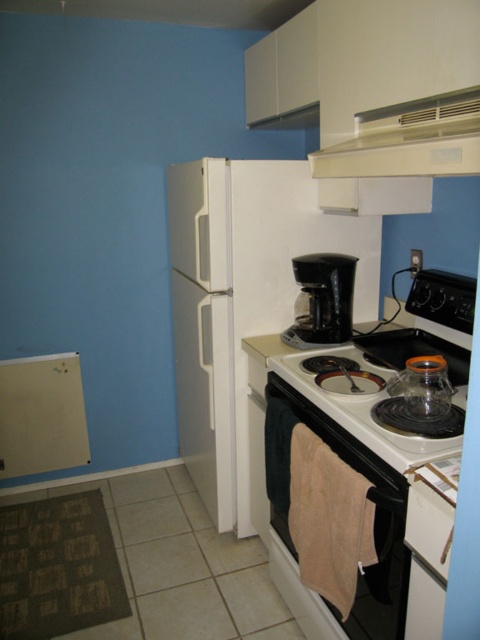
Can you confirm if black glossy oven at center is shorter than black plastic coffee maker at center?

No.

Is black glossy oven at center taller than black plastic coffee maker at center?

Indeed, black glossy oven at center has a greater height compared to black plastic coffee maker at center.

This screenshot has width=480, height=640. Identify the location of black glossy oven at center. (383, 586).

Locate an element on the screen. black glossy oven at center is located at coordinates (383, 586).

From the picture: Is white matte refrigerator at left further to camera compared to black glossy oven at center?

Yes, it is behind black glossy oven at center.

Does point (201, 483) come closer to viewer compared to point (350, 612)?

No, it is behind (350, 612).

What do you see at coordinates (241, 301) in the screenshot? The image size is (480, 640). I see `white matte refrigerator at left` at bounding box center [241, 301].

The image size is (480, 640). I want to click on white matte refrigerator at left, so click(241, 301).

Between white plastic exhaust hood at upper center and black glossy oven at center, which one has less height?

white plastic exhaust hood at upper center is shorter.

Does white plastic exhaust hood at upper center have a greater height compared to black glossy oven at center?

In fact, white plastic exhaust hood at upper center may be shorter than black glossy oven at center.

Between point (389, 116) and point (271, 518), which one is positioned in front?

Point (389, 116)

What are the coordinates of `white plastic exhaust hood at upper center` in the screenshot? It's located at (408, 140).